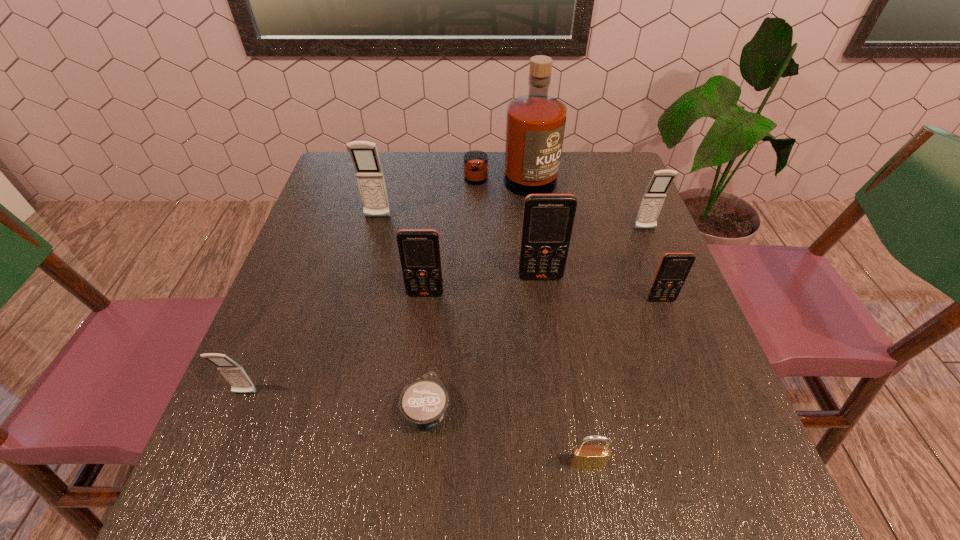
This screenshot has width=960, height=540. Identify the location of the rightmost orange cellular telephone. (674, 268).

I want to click on the leftmost object, so point(235,375).

At what (x,y) coordinates should I click in order to perform the action: click on the nearest cellular telephone. Please return your answer as a coordinate pair (x, y). The height and width of the screenshot is (540, 960). Looking at the image, I should click on (235, 375).

Where is `padlock`? The width and height of the screenshot is (960, 540). padlock is located at coordinates pyautogui.click(x=589, y=456).

What are the coordinates of `brass padlock` in the screenshot? It's located at (589, 456).

Locate an element on the screen. yogurt is located at coordinates (423, 402).

Find the location of a particular element. This screenshot has height=540, width=960. vacant area situated on the front label of the farthest object is located at coordinates (518, 280).

Image resolution: width=960 pixels, height=540 pixels. In order to click on free region located on the front-facing side of the eighth object from right to left in this screenshot , I will do `click(370, 247)`.

Identify the location of free space located 0.290m on the screen of the farthest orange cellular telephone. This screenshot has height=540, width=960. (557, 400).

Locate an element on the screen. The height and width of the screenshot is (540, 960). vacant position located 0.190m on the front-facing side of the seventh nearest object is located at coordinates (668, 288).